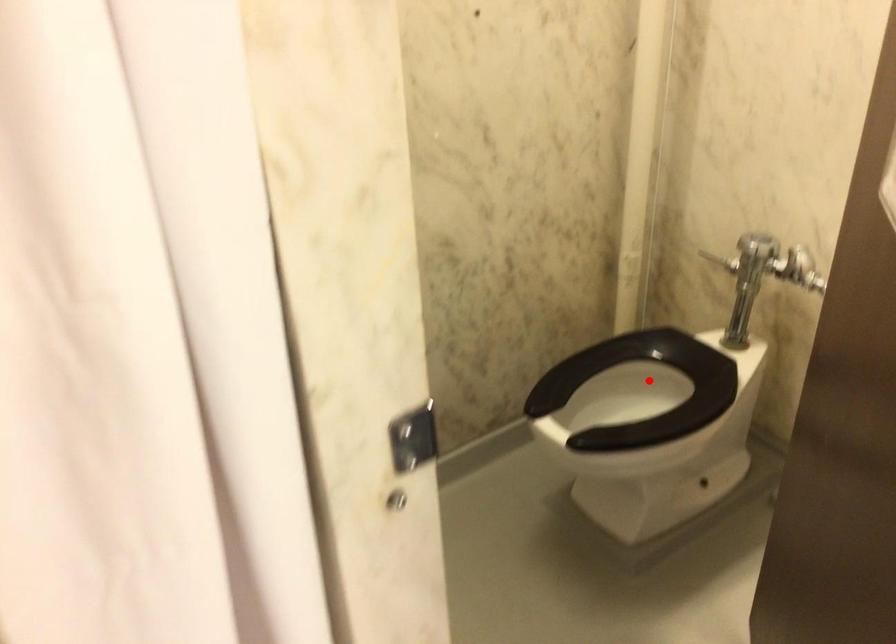
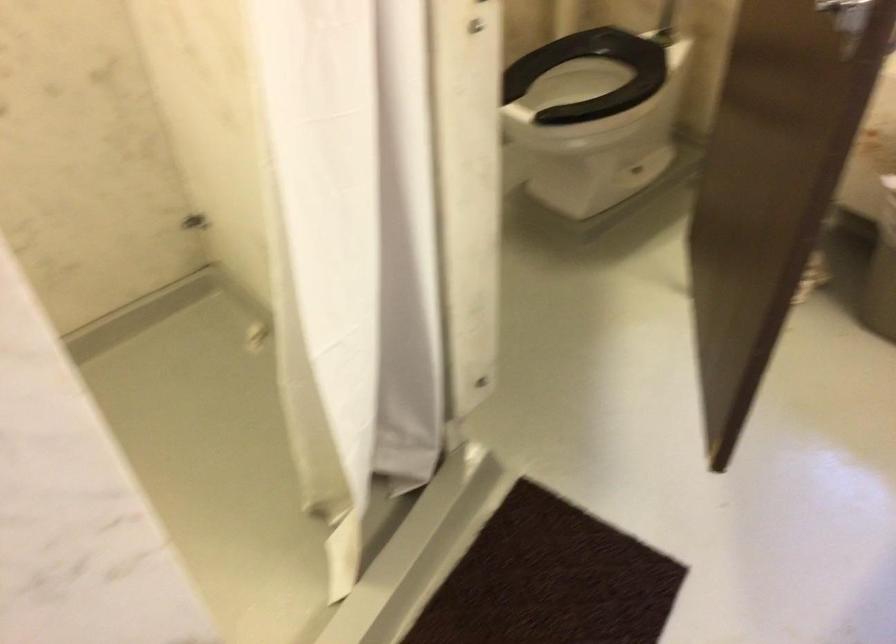
Find the pixel in the second image that matches the highlighted location in the first image.

(591, 75)